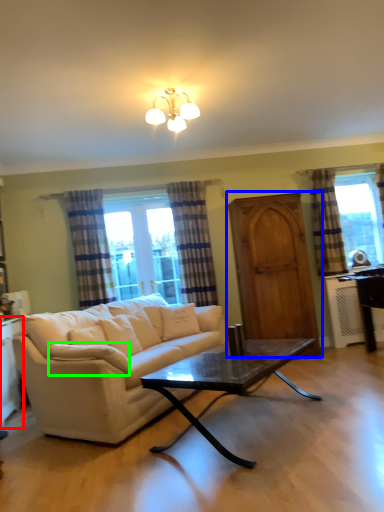
Question: Which object is the farthest from cabinetry (highlighted by a red box)? Choose among these: screen door (highlighted by a blue box) or pillow (highlighted by a green box).

Choices:
 (A) screen door
 (B) pillow

Answer: (A)